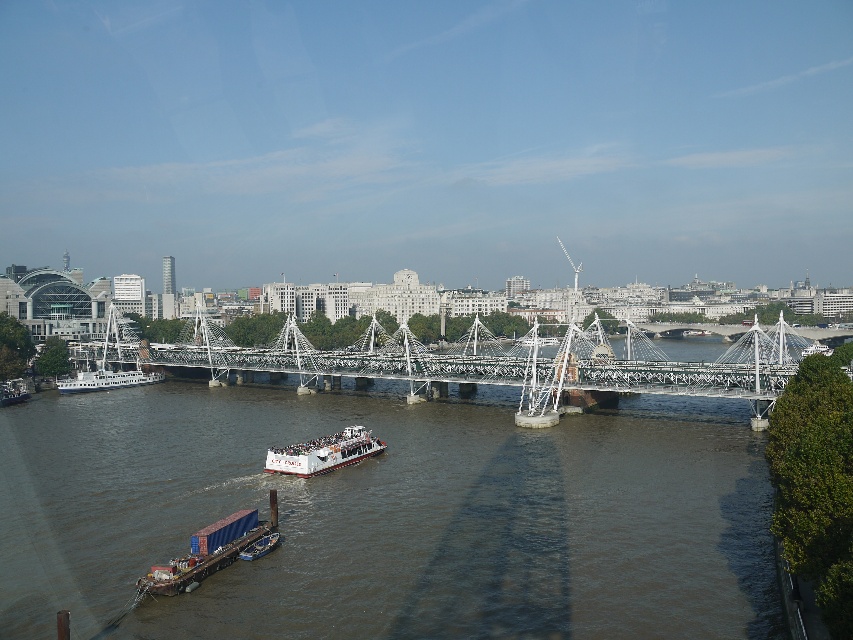
Question: Estimate the real-world distances between objects in this image. Which object is closer to the white metallic bridge at center?

Choices:
 (A) brown water at center
 (B) white matte boat at center
 (C) blue container ship at lower left
 (D) white glossy boat at left

Answer: (A)

Question: Among these points, which one is nearest to the camera?

Choices:
 (A) (332, 451)
 (B) (381, 326)
 (C) (68, 387)

Answer: (A)

Question: Considering the real-world distances, which object is closest to the blue container ship at lower left?

Choices:
 (A) white metallic bridge at center
 (B) white matte boat at center
 (C) brown water at center
 (D) white glossy boat at left

Answer: (C)

Question: Can you confirm if blue container ship at lower left is positioned below white matte boat at center?

Choices:
 (A) yes
 (B) no

Answer: (A)

Question: Is brown water at center bigger than white metallic bridge at center?

Choices:
 (A) no
 (B) yes

Answer: (A)

Question: Is blue container ship at lower left above white matte boat at center?

Choices:
 (A) yes
 (B) no

Answer: (B)